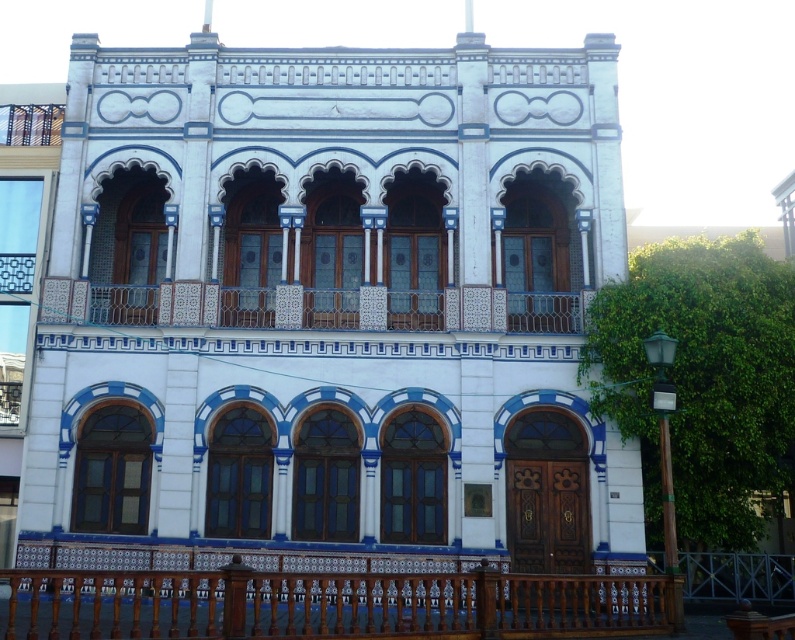
You are an architect evaluating the building structure. You need to install a new security camera. The camera requires a mounting point that can support its weight. Which object between the brown wooden balustrade at lower center and the white ceramic balcony at center would be more suitable based on their sizes?

The brown wooden balustrade at lower center has a larger size compared to the white ceramic balcony at center, so it would be more suitable for mounting the security camera as it can provide a sturdier and more stable support due to its larger structure.

You are standing in front of the building and want to locate the brown wooden balustrade at lower center. According to the coordinates given, where should you look to find it?

The brown wooden balustrade at lower center is located at the coordinates point (328, 604).